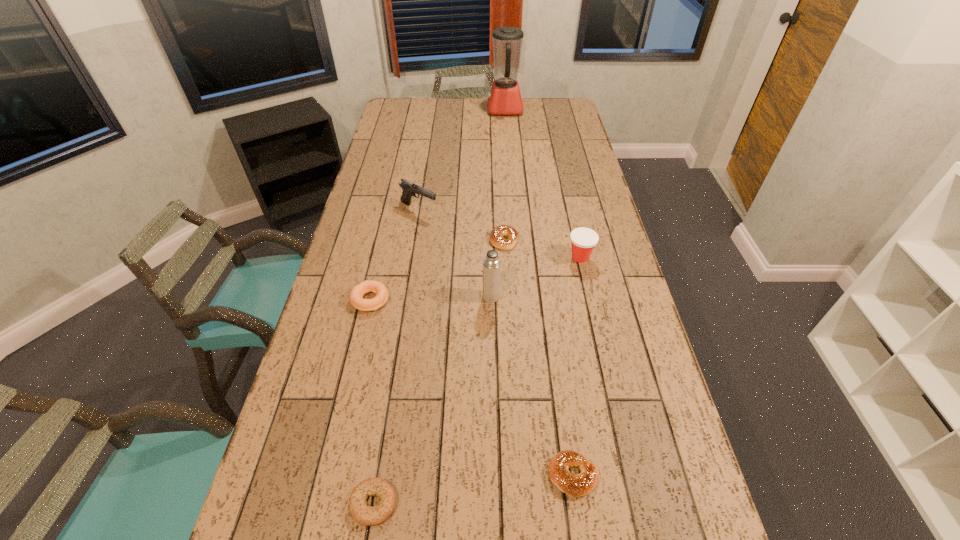
Identify the location of vacant position in the image that satisfies the following two spatial constraints: 1. at the muzzle of the gun; 2. on the left side of the thermos bottle. (405, 296).